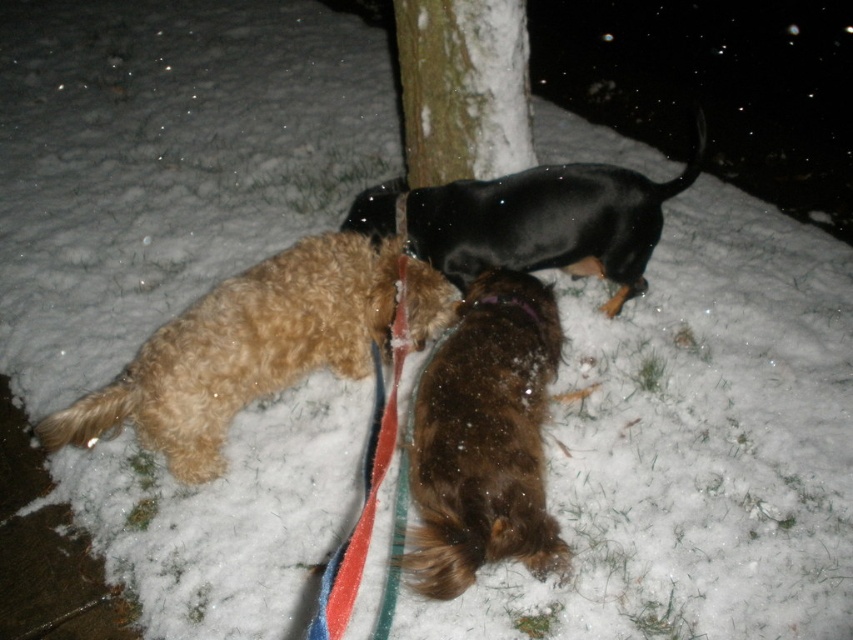
Does black glossy dog at center lie behind snow-covered bark at center?

That is False.

Can you confirm if black glossy dog at center is shorter than snow-covered bark at center?

In fact, black glossy dog at center may be taller than snow-covered bark at center.

Does point (643, 268) come closer to viewer compared to point (460, 81)?

Yes, it is in front of point (460, 81).

At what (x,y) coordinates should I click in order to perform the action: click on black glossy dog at center. Please return your answer as a coordinate pair (x, y). This screenshot has height=640, width=853. Looking at the image, I should click on coord(534,220).

Can you confirm if brown fuzzy dog at center is bigger than black glossy dog at center?

No.

Can you confirm if brown fuzzy dog at center is thinner than black glossy dog at center?

Yes, brown fuzzy dog at center is thinner than black glossy dog at center.

In order to click on brown fuzzy dog at center in this screenshot , I will do `click(485, 438)`.

Can you confirm if fuzzy brown dog at lower left is shorter than black glossy dog at center?

No, fuzzy brown dog at lower left is not shorter than black glossy dog at center.

This screenshot has width=853, height=640. What do you see at coordinates (242, 349) in the screenshot? I see `fuzzy brown dog at lower left` at bounding box center [242, 349].

Is point (347, 288) closer to viewer compared to point (517, 248)?

Yes, it is.

Identify the location of fuzzy brown dog at lower left. (242, 349).